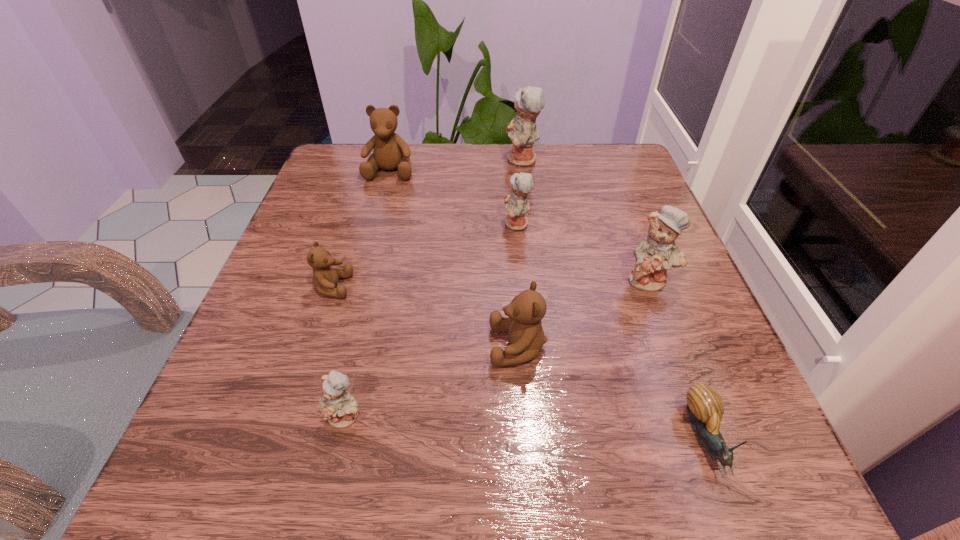
Point out which blue teddy bear is positioned as the second nearest to the sixth nearest object. Please provide its 2D coordinates. Your answer should be formatted as a tuple, i.e. [(x, y)], where the tuple contains the x and y coordinates of a point satisfying the conditions above.

[(659, 252)]

Identify the location of the third closest brown teddy bear to the biggest blue teddy bear. (526, 337).

Choose which brown teddy bear is the second nearest neighbor to the sixth farthest teddy bear. Please provide its 2D coordinates. Your answer should be formatted as a tuple, i.e. [(x, y)], where the tuple contains the x and y coordinates of a point satisfying the conditions above.

[(391, 152)]

Where is `vacant space that satisfies the following two spatial constraints: 1. on the front-facing side of the second biggest brown teddy bear; 2. on the front-facing side of the leftmost blue teddy bear`? The height and width of the screenshot is (540, 960). vacant space that satisfies the following two spatial constraints: 1. on the front-facing side of the second biggest brown teddy bear; 2. on the front-facing side of the leftmost blue teddy bear is located at coordinates (523, 416).

Locate an element on the screen. vacant space that satisfies the following two spatial constraints: 1. on the front-facing side of the third nearest object; 2. on the front-facing side of the leftmost blue teddy bear is located at coordinates (523, 416).

Where is `vacant position in the image that satisfies the following two spatial constraints: 1. on the front-facing side of the rightmost blue teddy bear; 2. on the front-facing side of the second farthest brown teddy bear`? vacant position in the image that satisfies the following two spatial constraints: 1. on the front-facing side of the rightmost blue teddy bear; 2. on the front-facing side of the second farthest brown teddy bear is located at coordinates (652, 287).